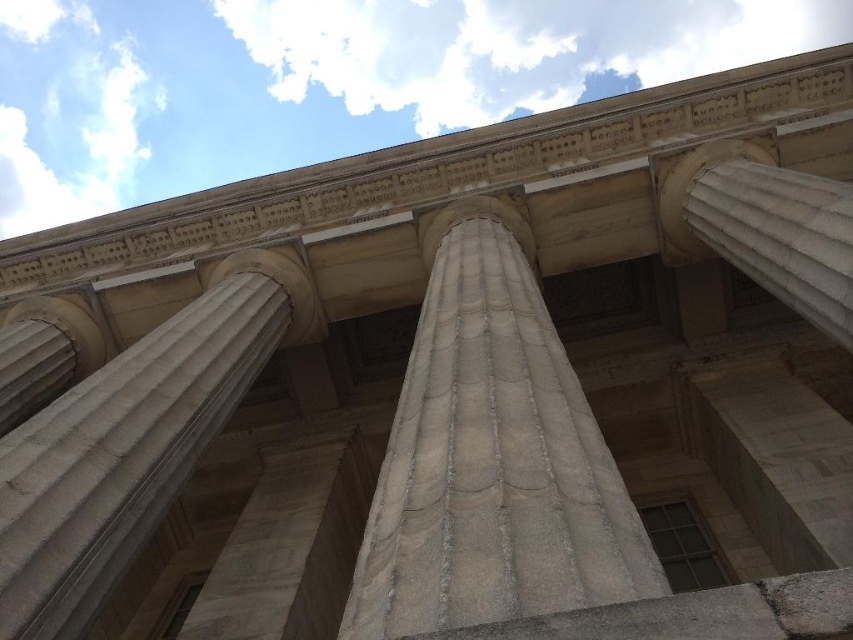
Question: Which of the following is the farthest from the observer?

Choices:
 (A) white marble column at upper right
 (B) white stone column at center

Answer: (A)

Question: Which point is closer to the camera taking this photo?

Choices:
 (A) (437, 422)
 (B) (76, 420)

Answer: (A)

Question: Which object appears farthest from the camera in this image?

Choices:
 (A) white marble column at center
 (B) white marble column at upper right
 (C) white stone column at center

Answer: (B)

Question: Is white stone column at center behind white marble column at center?

Choices:
 (A) no
 (B) yes

Answer: (A)

Question: Does white marble column at center have a larger size compared to white marble column at upper right?

Choices:
 (A) yes
 (B) no

Answer: (A)

Question: Does white stone column at center lie behind white marble column at upper right?

Choices:
 (A) no
 (B) yes

Answer: (A)